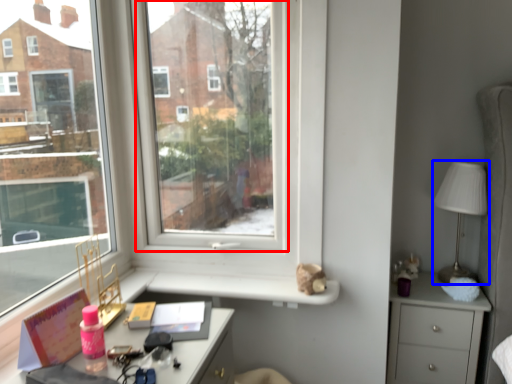
Question: Which point is further to the camera, window screen (highlighted by a red box) or table lamp (highlighted by a blue box)?

Choices:
 (A) window screen
 (B) table lamp

Answer: (B)